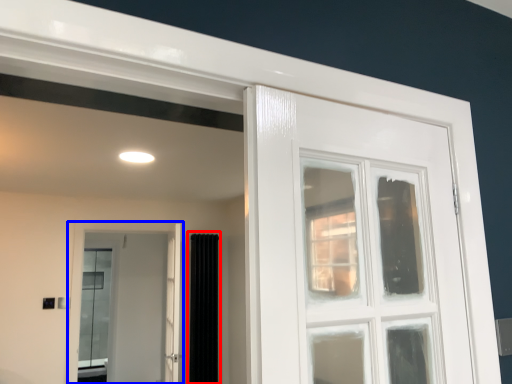
Question: Which point is closer to the camera, curtain (highlighted by a red box) or door (highlighted by a blue box)?

Choices:
 (A) curtain
 (B) door

Answer: (B)